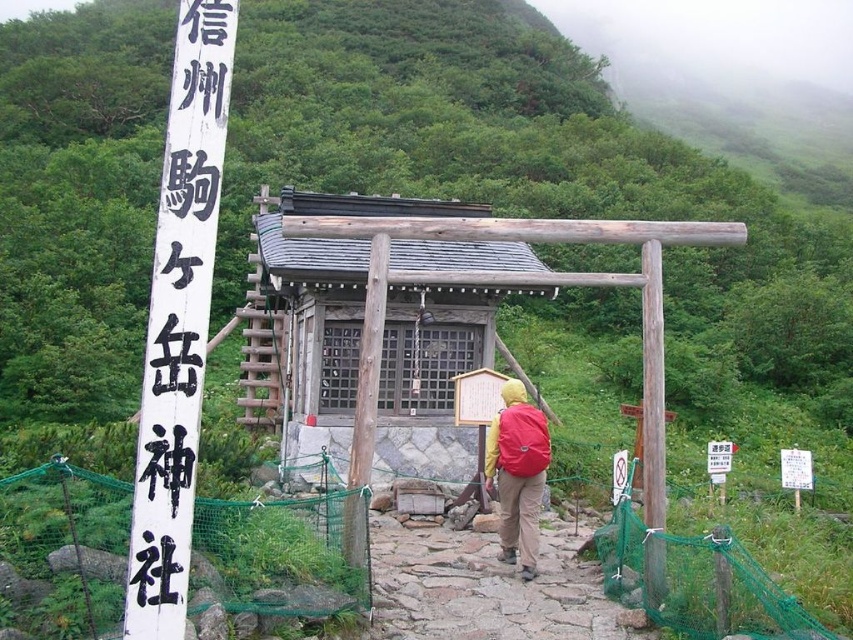
Which is below, wooden shrine at center or brown stone path at center?

Positioned lower is brown stone path at center.

Does wooden shrine at center have a greater width compared to brown stone path at center?

Correct, the width of wooden shrine at center exceeds that of brown stone path at center.

Is point (467, 260) farther from camera compared to point (434, 534)?

Yes, it is.

Locate an element on the screen. wooden shrine at center is located at coordinates (318, 300).

Can you confirm if black wood sign at left is wider than brown stone path at center?

No, black wood sign at left is not wider than brown stone path at center.

Which is more to the right, black wood sign at left or brown stone path at center?

From the viewer's perspective, brown stone path at center appears more on the right side.

At what (x,y) coordinates should I click in order to perform the action: click on black wood sign at left. Please return your answer as a coordinate pair (x, y). The height and width of the screenshot is (640, 853). Looking at the image, I should click on (178, 321).

Who is taller, black wood sign at left or brown wooden pole at center?

Standing taller between the two is brown wooden pole at center.

Is black wood sign at left taller than brown wooden pole at center?

No.

At what (x,y) coordinates should I click in order to perform the action: click on black wood sign at left. Please return your answer as a coordinate pair (x, y). Image resolution: width=853 pixels, height=640 pixels. Looking at the image, I should click on (178, 321).

The width and height of the screenshot is (853, 640). What are the coordinates of `black wood sign at left` in the screenshot? It's located at (178, 321).